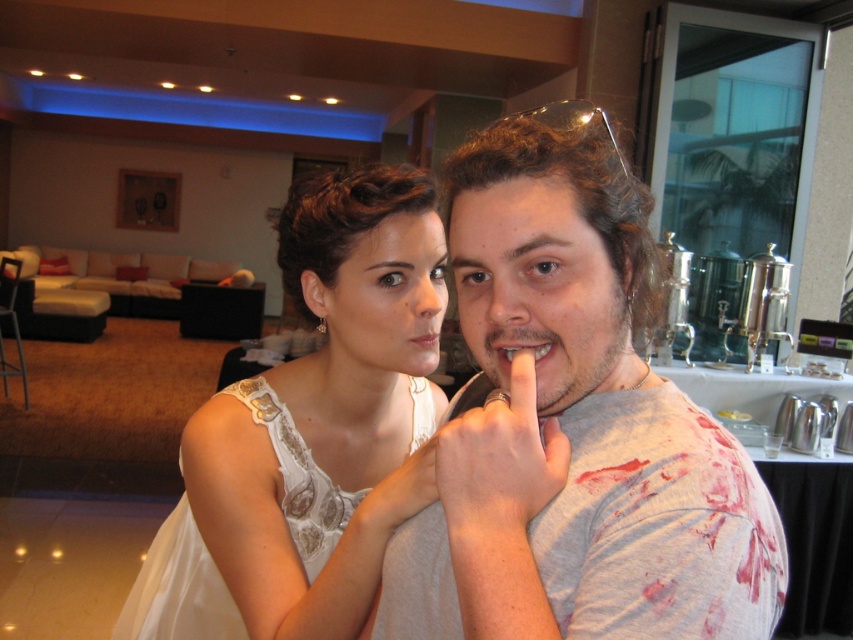
You are standing in the hotel lobby and want to discreetly approach the person making the shushing gesture. The point where you are currently standing is marked as point (706, 420). If you need to maintain a distance of at least 24 inches to avoid being noticed, will you be able to stay undetected?

The distance between you and the point (706, 420) is 23.41 inches, which is less than the required 24 inches. Therefore, you might be noticed if you stay at that point.

You are a photographer setting up for a group photo in a hotel lobby. You notice the white lace dress at center and the white fabric hand at center in the scene. Based on their sizes, which object would appear larger in the final photograph?

The white lace dress at center would appear larger in the final photograph since it is wider than the white fabric hand at center according to the description.